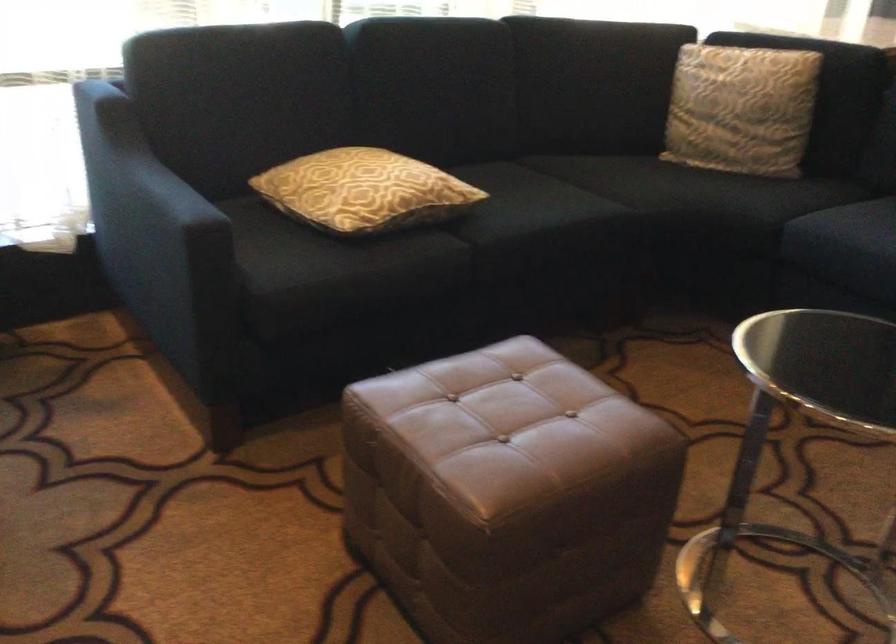
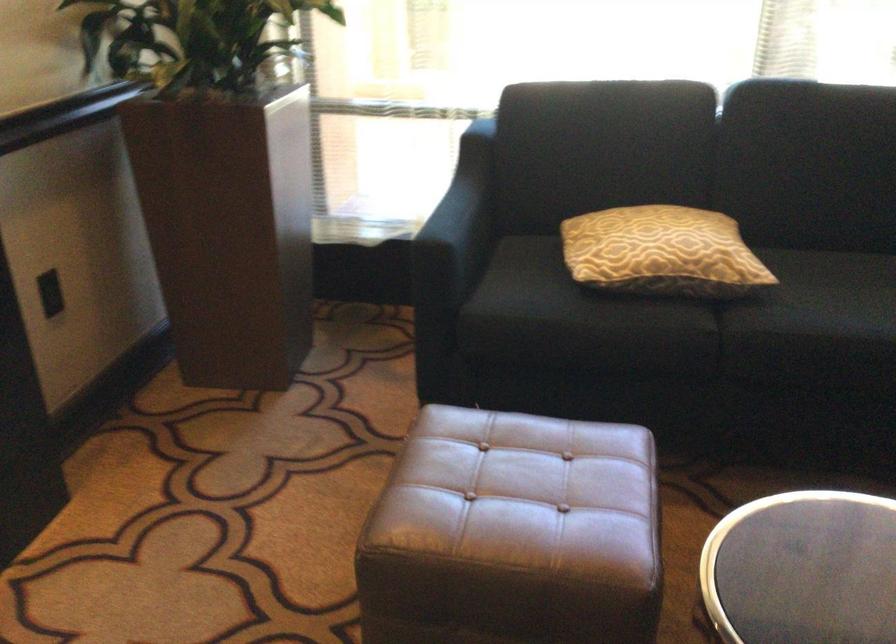
The point at (464, 207) is marked in the first image. Where is the corresponding point in the second image?

(752, 289)